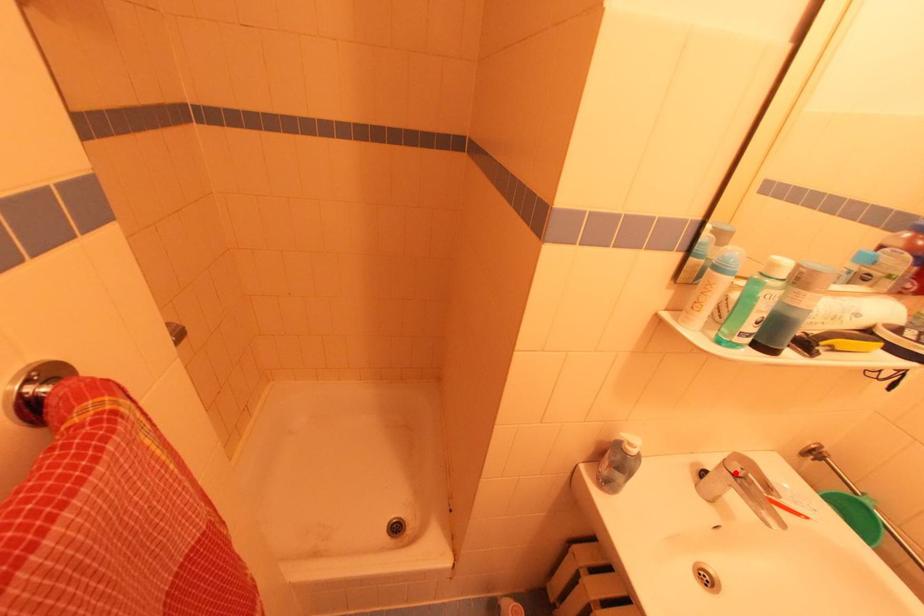
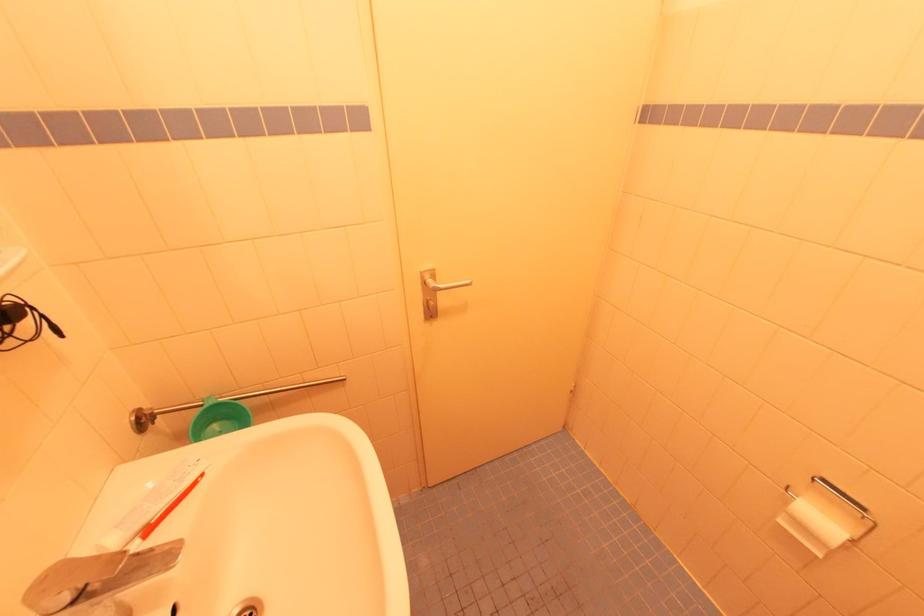
The point at the highlighted location is marked in the first image. Where is the corresponding point in the second image?

(69, 602)